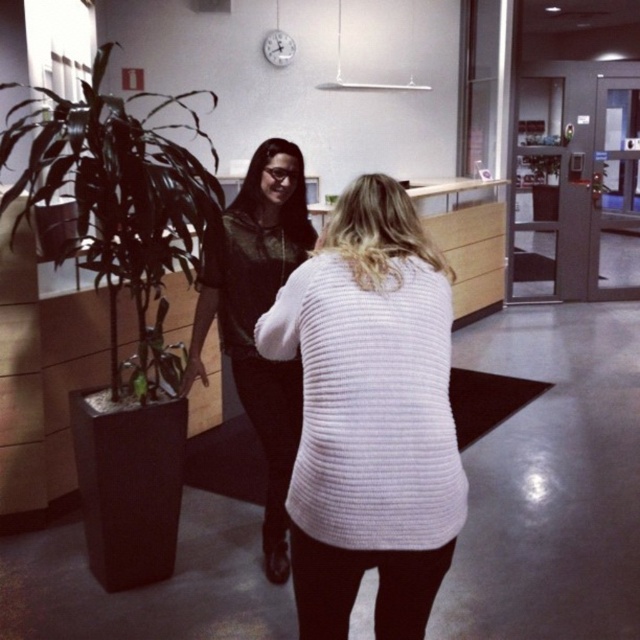
You are an office assistant who needs to place a new potted plant in the exact center of the room. Currently, there is a white ribbed sweater at center. Can you place the new plant without moving the sweater?

The white ribbed sweater at center is located at point (369,416), which is not the exact center of the room. Therefore, you can place the new potted plant in the exact center without moving the sweater.

You are a delivery robot with a 1.2 meter wide package. You need to move from the white ribbed sweater at center to the green leafy plant at center. Can you fit through the space between them?

The distance between the white ribbed sweater at center and the green leafy plant at center is 4.34 meters. Since the package is 1.2 meters wide, there is sufficient space to move through the area between them.